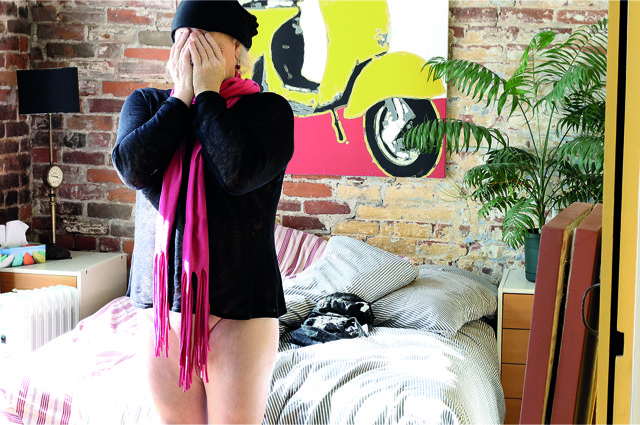
Find the location of a particular element. canvas is located at coordinates (420, 26).